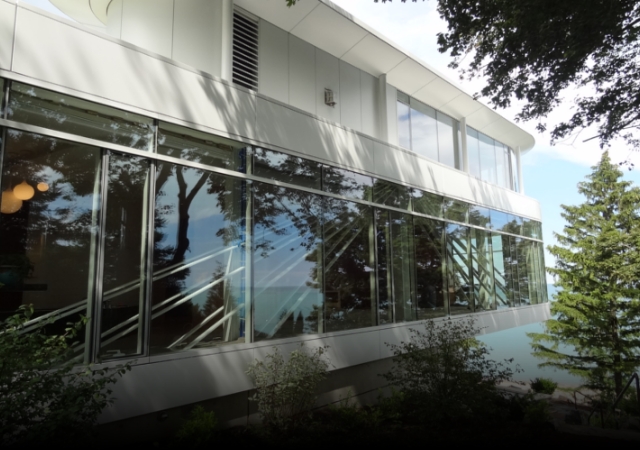
I want to click on window, so click(x=212, y=226).